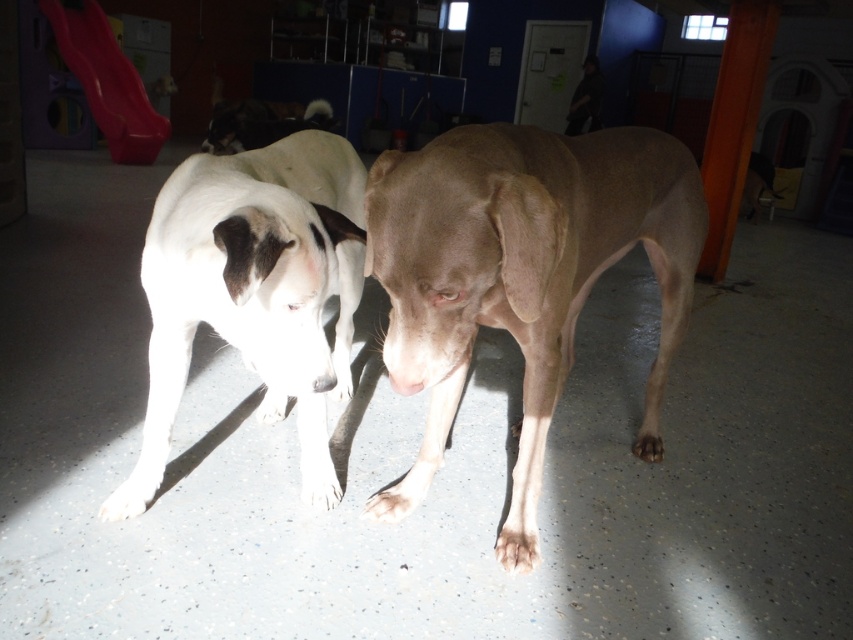
You are a volunteer at the shelter and need to place a new toy exactly at the point marked by the coordinates point (520, 275). Which dog is closest to this point?

The point (520, 275) corresponds to the smooth tan dog at center, so the smooth tan dog at center is closest to this point.

You are a volunteer at the animal shelter and need to determine which dog is shorter between the white fur dog at upper center and the black matte dog at center. Based on the scene, which one is shorter?

The white fur dog at upper center is shorter than the black matte dog at center.